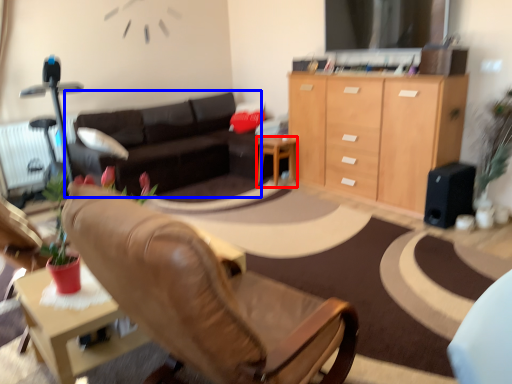
Question: Among these objects, which one is farthest to the camera, desk (highlighted by a red box) or studio couch (highlighted by a blue box)?

Choices:
 (A) desk
 (B) studio couch

Answer: (A)